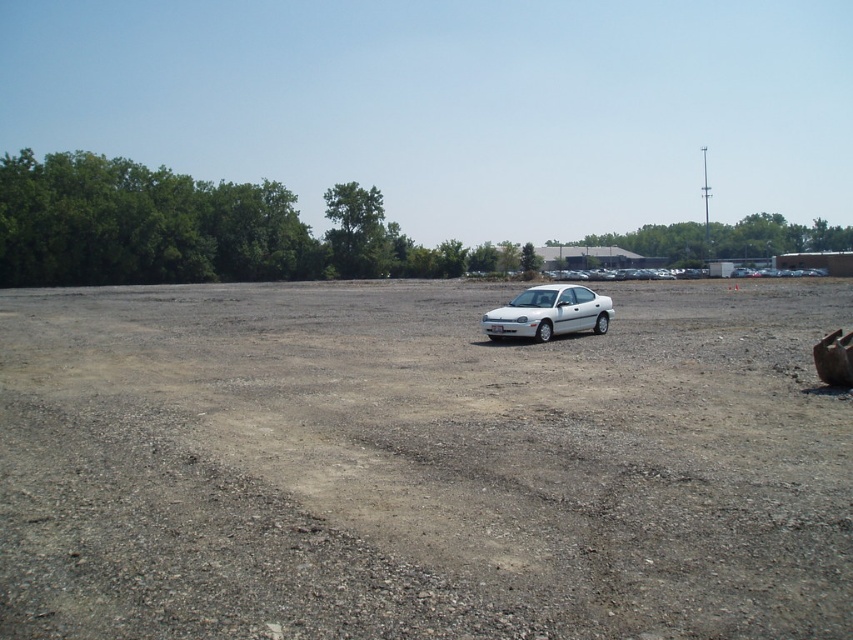
Does gray gravelly dirt field at center have a larger size compared to white matte car at center?

Indeed, gray gravelly dirt field at center has a larger size compared to white matte car at center.

Is gray gravelly dirt field at center smaller than white matte car at center?

Actually, gray gravelly dirt field at center might be larger than white matte car at center.

Is point (239, 401) positioned behind point (602, 314)?

No, (239, 401) is closer to viewer.

Image resolution: width=853 pixels, height=640 pixels. Find the location of `gray gravelly dirt field at center`. gray gravelly dirt field at center is located at coordinates (421, 465).